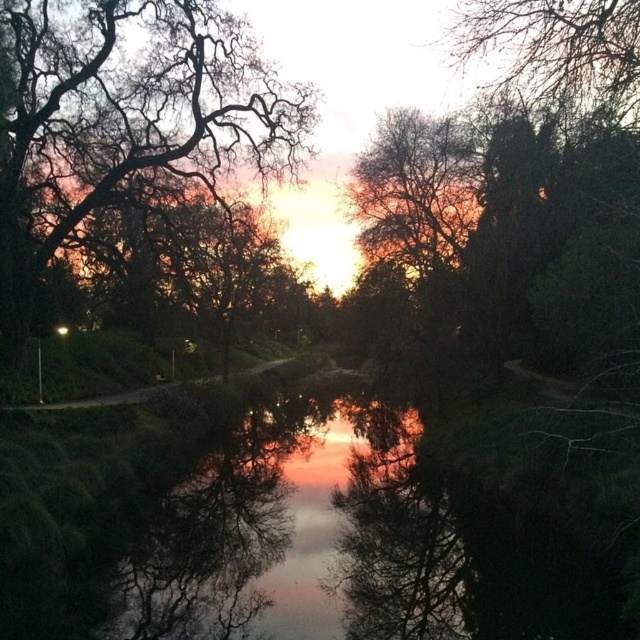
Question: Can you confirm if silhouette bare branches at upper left is smaller than bare branches at upper center?

Choices:
 (A) yes
 (B) no

Answer: (B)

Question: Where is silhouette bare branches at upper left located in relation to bare branches at upper center in the image?

Choices:
 (A) above
 (B) below

Answer: (A)

Question: Is silhouette bare branches at upper left positioned before bare branches at upper center?

Choices:
 (A) yes
 (B) no

Answer: (B)

Question: Which of the following is the farthest from the observer?

Choices:
 (A) silhouette bare branches at upper left
 (B) bare branches at upper center

Answer: (A)